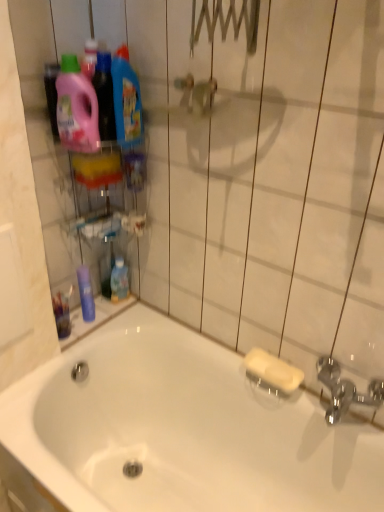
Question: Considering the relative positions of pink plastic detergent at upper left, the second cleaning product in the right-to-left sequence, and blue glossy mouthwash at left, which appears as the 2th mouthwash when viewed from the right, in the image provided, is pink plastic detergent at upper left, the second cleaning product in the right-to-left sequence, to the right of blue glossy mouthwash at left, which appears as the 2th mouthwash when viewed from the right, from the viewer's perspective?

Choices:
 (A) yes
 (B) no

Answer: (A)

Question: From a real-world perspective, does pink plastic detergent at upper left, the first cleaning product positioned from the left, stand above blue glossy mouthwash at left, which is the 1th mouthwash from left to right?

Choices:
 (A) no
 (B) yes

Answer: (B)

Question: Does pink plastic detergent at upper left, the first cleaning product positioned from the left, have a lesser height compared to blue glossy mouthwash at left, which is the 1th mouthwash from left to right?

Choices:
 (A) no
 (B) yes

Answer: (A)

Question: From the image's perspective, is pink plastic detergent at upper left, the first cleaning product positioned from the left, on blue glossy mouthwash at left, which appears as the 2th mouthwash when viewed from the right?

Choices:
 (A) no
 (B) yes

Answer: (B)

Question: From a real-world perspective, is pink plastic detergent at upper left, the first cleaning product positioned from the left, positioned under blue glossy mouthwash at left, which is the 1th mouthwash from left to right, based on gravity?

Choices:
 (A) no
 (B) yes

Answer: (A)

Question: Based on their sizes in the image, would you say blue glossy mouthwash at left, which is the 1th mouthwash from left to right, is bigger or smaller than pink plastic detergent at upper left, the first cleaning product positioned from the left?

Choices:
 (A) big
 (B) small

Answer: (B)

Question: Is blue glossy mouthwash at left, which is the 1th mouthwash from left to right, to the left or to the right of pink plastic detergent at upper left, the second cleaning product in the right-to-left sequence, in the image?

Choices:
 (A) right
 (B) left

Answer: (B)

Question: From the image's perspective, is blue glossy mouthwash at left, which appears as the 2th mouthwash when viewed from the right, positioned above or below pink plastic detergent at upper left, the second cleaning product in the right-to-left sequence?

Choices:
 (A) below
 (B) above

Answer: (A)

Question: Considering the positions of blue glossy mouthwash at left, which appears as the 2th mouthwash when viewed from the right, and pink plastic detergent at upper left, the first cleaning product positioned from the left, in the image, is blue glossy mouthwash at left, which appears as the 2th mouthwash when viewed from the right, taller or shorter than pink plastic detergent at upper left, the first cleaning product positioned from the left,?

Choices:
 (A) tall
 (B) short

Answer: (B)

Question: Considering the positions of blue glossy detergent at upper left, the first cleaning product viewed from the right, and blue glossy mouthwash at left, which appears as the 2th mouthwash when viewed from the right, in the image, is blue glossy detergent at upper left, the first cleaning product viewed from the right, taller or shorter than blue glossy mouthwash at left, which appears as the 2th mouthwash when viewed from the right,?

Choices:
 (A) short
 (B) tall

Answer: (B)

Question: From a real-world perspective, is blue glossy detergent at upper left, the first cleaning product viewed from the right, positioned above or below blue glossy mouthwash at left, which appears as the 2th mouthwash when viewed from the right?

Choices:
 (A) above
 (B) below

Answer: (A)

Question: Choose the correct answer: Is blue glossy detergent at upper left, the 2th cleaning product when ordered from left to right, inside blue glossy mouthwash at left, which is the 1th mouthwash from left to right, or outside it?

Choices:
 (A) inside
 (B) outside

Answer: (B)

Question: Looking at the image, does blue glossy detergent at upper left, the 2th cleaning product when ordered from left to right, seem bigger or smaller compared to blue glossy mouthwash at left, which is the 1th mouthwash from left to right?

Choices:
 (A) big
 (B) small

Answer: (A)

Question: From the image's perspective, is blue glossy mouthwash at lower center, which is the 2th mouthwash in left-to-right order, above or below blue glossy mouthwash at left, which appears as the 2th mouthwash when viewed from the right?

Choices:
 (A) below
 (B) above

Answer: (B)

Question: Relative to blue glossy mouthwash at left, which is the 1th mouthwash from left to right, is blue glossy mouthwash at lower center, which is the first mouthwash from right to left, in front or behind?

Choices:
 (A) front
 (B) behind

Answer: (B)